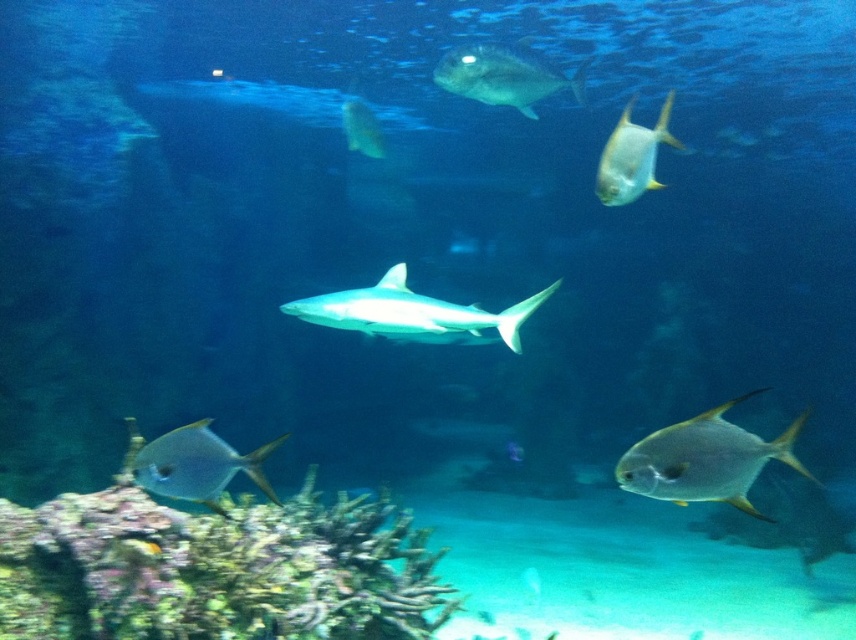
Can you confirm if green coral reef at lower left is positioned to the right of shiny silver fish at lower left?

Yes, green coral reef at lower left is to the right of shiny silver fish at lower left.

Who is positioned more to the right, green coral reef at lower left or shiny silver fish at lower left?

Positioned to the right is green coral reef at lower left.

Does point (239, 525) lie behind point (173, 488)?

Yes, it is.

Where is `green coral reef at lower left`? The width and height of the screenshot is (856, 640). green coral reef at lower left is located at coordinates (217, 570).

Does smooth gray shark at center have a lesser height compared to shiny silver fish at lower left?

Indeed, smooth gray shark at center has a lesser height compared to shiny silver fish at lower left.

Is smooth gray shark at center positioned behind shiny silver fish at lower left?

That is True.

The image size is (856, 640). What are the coordinates of `smooth gray shark at center` in the screenshot? It's located at (409, 310).

The image size is (856, 640). Identify the location of smooth gray shark at center. (409, 310).

Is point (251, 467) more distant than point (486, 45)?

That is False.

Does shiny silver fish at lower left have a smaller size compared to shiny silver fish at upper center?

Yes, shiny silver fish at lower left is smaller than shiny silver fish at upper center.

Which is in front, point (259, 481) or point (510, 67)?

Point (259, 481) is in front.

Image resolution: width=856 pixels, height=640 pixels. In order to click on shiny silver fish at lower left in this screenshot , I will do `click(193, 464)`.